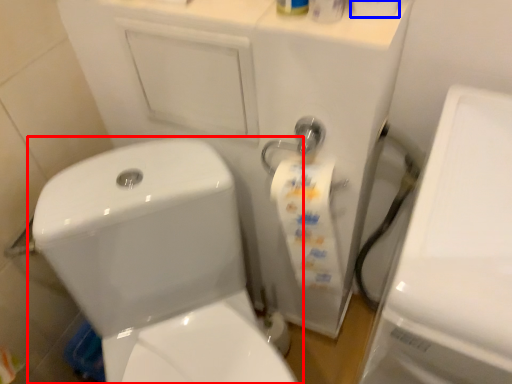
Question: Which object appears farthest to the camera in this image, toilet (highlighted by a red box) or toilet paper (highlighted by a blue box)?

Choices:
 (A) toilet
 (B) toilet paper

Answer: (A)